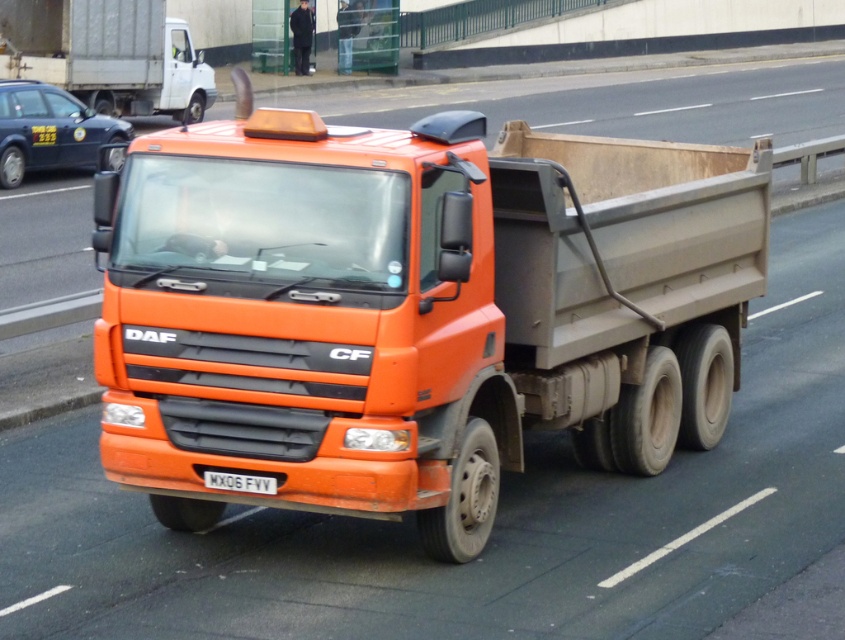
You are a pedestrian standing on the sidewalk. You see an orange matte truck at upper left and a metallic blue taxi at left. The truck is moving towards you. If the truck needs to stop, will it be able to stop before reaching the taxi?

The distance between the orange matte truck at upper left and the metallic blue taxi at left is 4.53 meters. However, without knowing the truck speed or braking distance, it is impossible to determine if it can stop before reaching the taxi.

You are a photographer trying to capture both the orange matte truck at upper left and the metallic blue taxi at left in a single frame. Based on their sizes, which vehicle should you position closer to the camera to ensure both fit in the frame?

Since the orange matte truck at upper left is wider than the metallic blue taxi at left, you should position the orange matte truck at upper left closer to the camera and the metallic blue taxi at left farther away. This way, the larger truck will take up more space near the camera, while the smaller taxi can be placed farther back to balance the composition and fit both in the frame.

Looking at this image, you are a photographer standing on the side of the road where the bright orange DAF CF truck is driving. You want to take a photo that includes both the point at (x=195, y=234) and the point at (x=273, y=493). Which point is closer to the camera so you can adjust your focus accordingly?

Point (x=195, y=234) is closer to the camera than point (x=273, y=493), so you should focus on that point first.